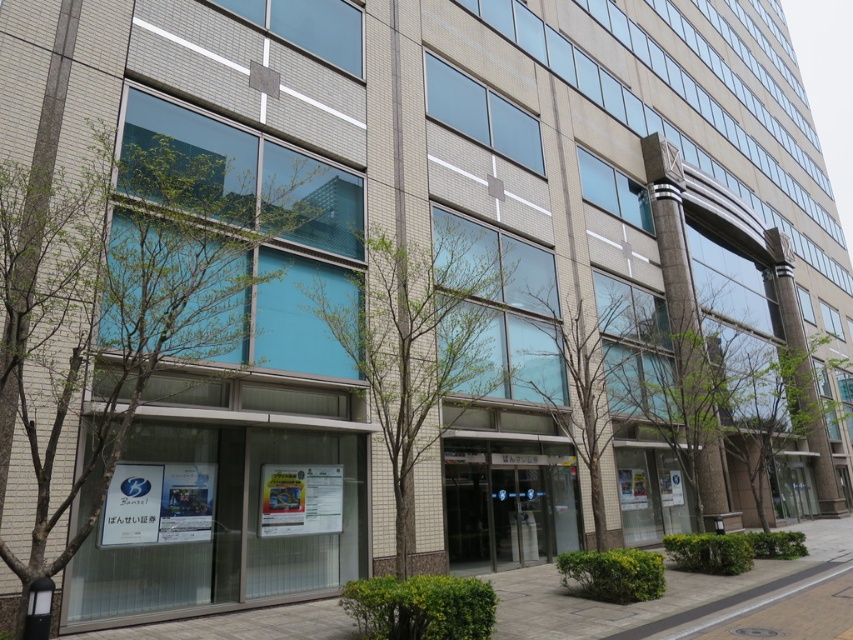
Does transparent glass window at center have a lesser height compared to smooth concrete pavement at lower center?

No, transparent glass window at center is not shorter than smooth concrete pavement at lower center.

In the scene shown: Does transparent glass window at center have a lesser width compared to smooth concrete pavement at lower center?

Yes, transparent glass window at center is thinner than smooth concrete pavement at lower center.

Is point (120, 250) less distant than point (497, 625)?

Yes, point (120, 250) is closer to viewer.

The image size is (853, 640). I want to click on transparent glass window at center, so click(x=119, y=305).

Between smooth concrete pavement at lower center and bare branches at center, which one is positioned lower?

smooth concrete pavement at lower center

Who is positioned more to the right, smooth concrete pavement at lower center or bare branches at center?

smooth concrete pavement at lower center

The height and width of the screenshot is (640, 853). Identify the location of smooth concrete pavement at lower center. (697, 600).

Which of these two, transparent glass window at center or bare branches at center, stands shorter?

bare branches at center is shorter.

Is point (44, 284) positioned after point (558, 330)?

No, it is in front of (558, 330).

At what (x,y) coordinates should I click in order to perform the action: click on transparent glass window at center. Please return your answer as a coordinate pair (x, y). Looking at the image, I should click on (119, 305).